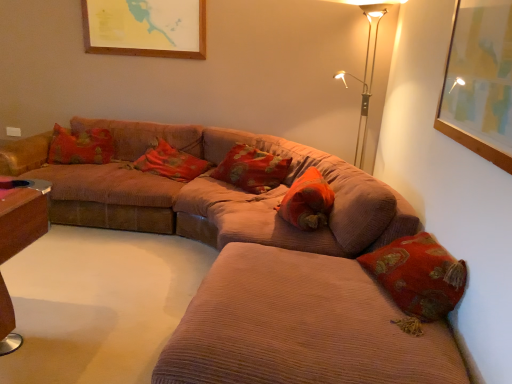
Measure the distance between red velvet cushion at center, which is the third pillow from left to right, and camera.

2.48 meters.

What is the approximate width of matte red pillow at center, the 2th pillow in the right-to-left sequence?

The width of matte red pillow at center, the 2th pillow in the right-to-left sequence, is 13.15 inches.

This screenshot has width=512, height=384. Identify the location of corduroy pillow at center, marked as the third pillow in a right-to-left arrangement. (170, 162).

Image resolution: width=512 pixels, height=384 pixels. What are the coordinates of `corduroy couch at lower right` in the screenshot? It's located at (300, 327).

In order to click on red velvet cushion at center, which is the first pillow from right to left in this screenshot , I will do `click(307, 201)`.

There is a corduroy pillow at center, arranged as the first pillow when viewed from the left. At what (x,y) coordinates should I click in order to perform the action: click on the 1st pillow above it (from a real-world perspective). Please return your answer as a coordinate pair (x, y). The width and height of the screenshot is (512, 384). Looking at the image, I should click on (307, 201).

Between corduroy pillow at center, arranged as the first pillow when viewed from the left, and red velvet cushion at center, which is the first pillow from right to left, which one has less height?

Standing shorter between the two is red velvet cushion at center, which is the first pillow from right to left.

Consider the image. From the image's perspective, between corduroy pillow at center, arranged as the first pillow when viewed from the left, and red velvet cushion at center, which is the first pillow from right to left, which one is located above?

corduroy pillow at center, arranged as the first pillow when viewed from the left, from the image's perspective.

Which of these two, corduroy pillow at center, arranged as the first pillow when viewed from the left, or red velvet cushion at center, which is the first pillow from right to left, is smaller?

With smaller size is red velvet cushion at center, which is the first pillow from right to left.

Is metallic gold floor lamp at upper right aimed at corduroy couch at lower right?

Yes, metallic gold floor lamp at upper right is aimed at corduroy couch at lower right.

In terms of width, does metallic gold floor lamp at upper right look wider or thinner when compared to corduroy couch at lower right?

In the image, metallic gold floor lamp at upper right appears to be more narrow than corduroy couch at lower right.

Could corduroy couch at lower right be considered to be inside metallic gold floor lamp at upper right?

No, corduroy couch at lower right is located outside of metallic gold floor lamp at upper right.

From the image's perspective, is metallic gold floor lamp at upper right beneath corduroy couch at lower right?

No.

Between brown corduroy couch at center and corduroy couch at lower right, which one has more height?

brown corduroy couch at center.

Measure the distance from brown corduroy couch at center to corduroy couch at lower right.

They are 99.46 centimeters apart.

This screenshot has height=384, width=512. I want to click on studio couch behind the corduroy couch at lower right, so click(x=210, y=192).

Which is in front, point (115, 131) or point (193, 383)?

The point (193, 383) is in front.

Would you say corduroy couch at lower right is a long distance from corduroy pillow at center, arranged as the first pillow when viewed from the left?

Yes, corduroy couch at lower right is far from corduroy pillow at center, arranged as the first pillow when viewed from the left.

From the image's perspective, which one is positioned lower, corduroy couch at lower right or corduroy pillow at center, marked as the third pillow in a right-to-left arrangement?

corduroy couch at lower right, from the image's perspective.

Consider the image. In terms of width, does corduroy couch at lower right look wider or thinner when compared to corduroy pillow at center, arranged as the first pillow when viewed from the left?

Clearly, corduroy couch at lower right has more width compared to corduroy pillow at center, arranged as the first pillow when viewed from the left.

From a real-world perspective, which is physically below, corduroy couch at lower right or corduroy pillow at center, arranged as the first pillow when viewed from the left?

corduroy couch at lower right, from a real-world perspective.

Is corduroy couch at lower right next to red velvet cushion at center, which is the third pillow from left to right, and touching it?

No, corduroy couch at lower right is not beside red velvet cushion at center, which is the third pillow from left to right.

Where is `couch on the left of red velvet cushion at center, which is the third pillow from left to right`? couch on the left of red velvet cushion at center, which is the third pillow from left to right is located at coordinates (300, 327).

Is corduroy couch at lower right not within red velvet cushion at center, which is the third pillow from left to right?

That's correct, corduroy couch at lower right is outside of red velvet cushion at center, which is the third pillow from left to right.

Is red velvet cushion at center, which is the third pillow from left to right, wider than brown corduroy couch at center?

No, red velvet cushion at center, which is the third pillow from left to right, is not wider than brown corduroy couch at center.

Can you see red velvet cushion at center, which is the first pillow from right to left, touching brown corduroy couch at center?

red velvet cushion at center, which is the first pillow from right to left, and brown corduroy couch at center are clearly separated.

Does point (292, 223) come farther from viewer compared to point (245, 219)?

No.

Locate an element on the screen. pillow below the brown corduroy couch at center (from the image's perspective) is located at coordinates (307, 201).

Considering the sizes of objects corduroy pillow at center, arranged as the first pillow when viewed from the left, and corduroy couch at lower right in the image provided, who is taller, corduroy pillow at center, arranged as the first pillow when viewed from the left, or corduroy couch at lower right?

corduroy couch at lower right is taller.

Between corduroy pillow at center, arranged as the first pillow when viewed from the left, and corduroy couch at lower right, which one appears on the left side from the viewer's perspective?

Positioned to the left is corduroy pillow at center, arranged as the first pillow when viewed from the left.

Is corduroy pillow at center, marked as the third pillow in a right-to-left arrangement, positioned before corduroy couch at lower right?

No, it is not.

Who is bigger, corduroy pillow at center, arranged as the first pillow when viewed from the left, or corduroy couch at lower right?

With larger size is corduroy couch at lower right.

Identify the location of the 2nd pillow in front when counting from the corduroy pillow at center, arranged as the first pillow when viewed from the left. Image resolution: width=512 pixels, height=384 pixels. (307, 201).

Where is `couch on the left side of metallic gold floor lamp at upper right`? Image resolution: width=512 pixels, height=384 pixels. couch on the left side of metallic gold floor lamp at upper right is located at coordinates (300, 327).

Estimate the real-world distances between objects in this image. Which object is closer to brown corduroy couch at center, metallic gold floor lamp at upper right or red velvet cushion at center, which is the third pillow from left to right?

Based on the image, red velvet cushion at center, which is the third pillow from left to right, appears to be nearer to brown corduroy couch at center.

Considering their positions, is matte red pillow at center, the 2th pillow in the right-to-left sequence, positioned closer to brown corduroy couch at center than metallic gold floor lamp at upper right?

Among the two, matte red pillow at center, the 2th pillow in the right-to-left sequence, is located nearer to brown corduroy couch at center.

Looking at the image, which one is located further to metallic gold floor lamp at upper right, red velvet cushion at center, which is the first pillow from right to left, or brown corduroy couch at center?

Among the two, brown corduroy couch at center is located further to metallic gold floor lamp at upper right.

When comparing their distances from matte red pillow at center, the second pillow positioned from the left, does red velvet cushion at center, which is the first pillow from right to left, or corduroy pillow at center, arranged as the first pillow when viewed from the left, seem closer?

corduroy pillow at center, arranged as the first pillow when viewed from the left.

Based on their spatial positions, is matte red pillow at center, the 2th pillow in the right-to-left sequence, or metallic gold floor lamp at upper right closer to red velvet cushion at center, which is the third pillow from left to right?

The object closer to red velvet cushion at center, which is the third pillow from left to right, is matte red pillow at center, the 2th pillow in the right-to-left sequence.

Which object lies further to the anchor point corduroy couch at lower right, matte red pillow at center, the second pillow positioned from the left, or brown corduroy couch at center?

Based on the image, matte red pillow at center, the second pillow positioned from the left, appears to be further to corduroy couch at lower right.

From the image, which object appears to be nearer to corduroy pillow at center, arranged as the first pillow when viewed from the left, corduroy couch at lower right or metallic gold floor lamp at upper right?

metallic gold floor lamp at upper right.

From the image, which object appears to be farther from brown corduroy couch at center, corduroy pillow at center, marked as the third pillow in a right-to-left arrangement, or red velvet cushion at center, which is the first pillow from right to left?

red velvet cushion at center, which is the first pillow from right to left, lies further to brown corduroy couch at center than the other object.

Locate an element on the screen. This screenshot has height=384, width=512. table lamp positioned between corduroy couch at lower right and corduroy pillow at center, arranged as the first pillow when viewed from the left, from near to far is located at coordinates (366, 67).

Locate an element on the screen. Image resolution: width=512 pixels, height=384 pixels. pillow positioned between corduroy couch at lower right and metallic gold floor lamp at upper right from near to far is located at coordinates (307, 201).

This screenshot has height=384, width=512. I want to click on studio couch positioned between corduroy couch at lower right and corduroy pillow at center, arranged as the first pillow when viewed from the left, from near to far, so click(210, 192).

Where is `pillow between matte red pillow at center, the 2th pillow in the right-to-left sequence, and metallic gold floor lamp at upper right from left to right`? pillow between matte red pillow at center, the 2th pillow in the right-to-left sequence, and metallic gold floor lamp at upper right from left to right is located at coordinates (307, 201).